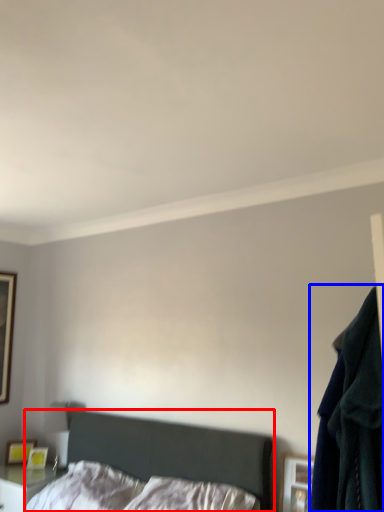
Question: Which object is closer to the camera taking this photo, bed (highlighted by a red box) or clothing (highlighted by a blue box)?

Choices:
 (A) bed
 (B) clothing

Answer: (A)